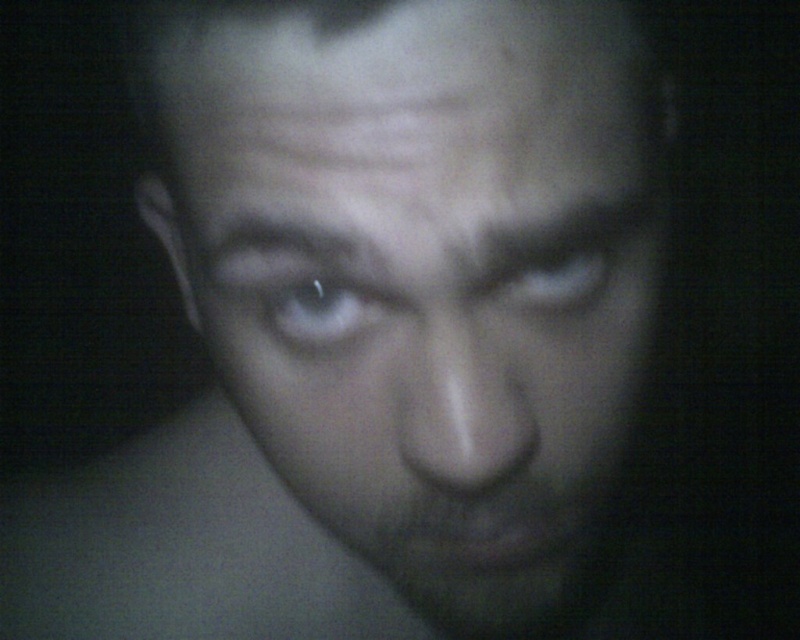
Question: Which object is farther from the camera taking this photo?

Choices:
 (A) smooth skin face at center
 (B) matte gray eye at upper center

Answer: (B)

Question: Can you confirm if smooth skin face at center is smaller than white glossy eye at center?

Choices:
 (A) no
 (B) yes

Answer: (A)

Question: Which point appears farthest from the camera in this image?

Choices:
 (A) coord(424,612)
 (B) coord(314,314)

Answer: (A)

Question: Which point is closer to the camera?

Choices:
 (A) (536, 529)
 (B) (381, 304)
 (C) (556, 264)

Answer: (B)

Question: Does smooth skin face at center appear under white glossy eye at center?

Choices:
 (A) no
 (B) yes

Answer: (B)

Question: Is white glossy eye at center positioned at the back of matte gray eye at upper center?

Choices:
 (A) no
 (B) yes

Answer: (A)